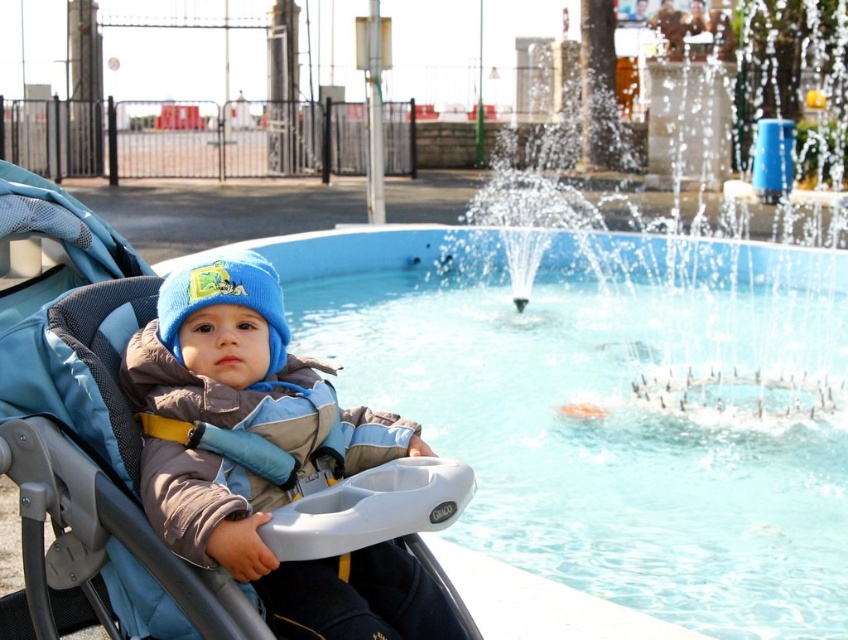
Question: Which of the following is the farthest from the observer?

Choices:
 (A) blue fabric baby carriage at left
 (B) clear blue water at center
 (C) knitted blue beanie at center
 (D) clear glass water at center

Answer: (D)

Question: Does blue fabric baby carriage at left appear under knitted blue beanie at center?

Choices:
 (A) yes
 (B) no

Answer: (A)

Question: Which point is farther from the camera taking this photo?

Choices:
 (A) (682, 408)
 (B) (531, 342)

Answer: (B)

Question: Can you confirm if clear glass water at center is wider than knitted blue beanie at center?

Choices:
 (A) yes
 (B) no

Answer: (A)

Question: Which point appears closest to the camera in this image?

Choices:
 (A) (520, 237)
 (B) (216, 280)
 (C) (845, 252)
 (D) (112, 588)

Answer: (D)

Question: Can you confirm if blue fabric baby carriage at left is positioned to the left of clear glass water at center?

Choices:
 (A) yes
 (B) no

Answer: (A)